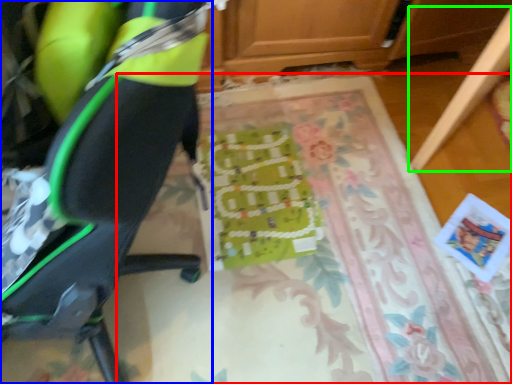
Question: Based on their relative distances, which object is farther from mat (highlighted by a red box)? Choose from chair (highlighted by a blue box) and furniture (highlighted by a green box).

Choices:
 (A) chair
 (B) furniture

Answer: (A)